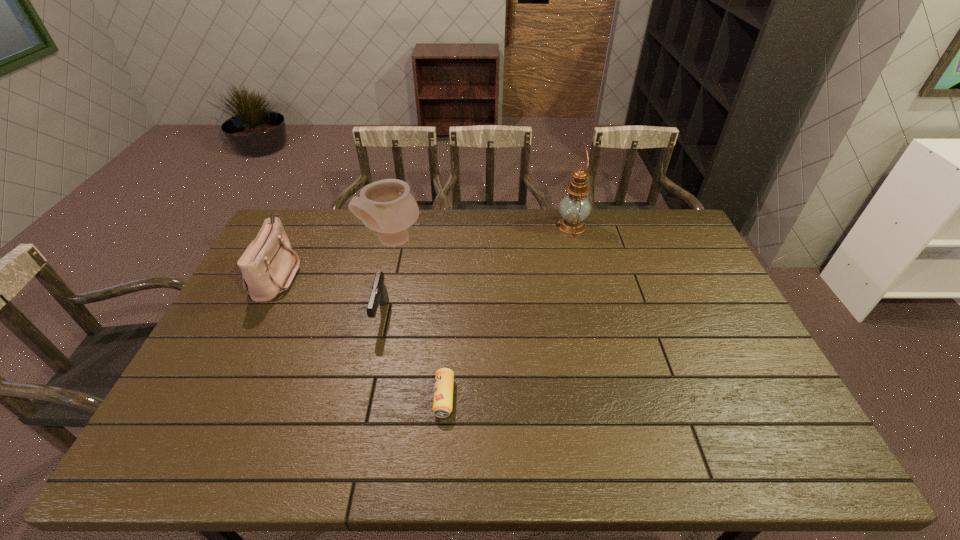
Locate an element on the screen. This screenshot has width=960, height=540. vacant space located on the front pocket of the leftmost object is located at coordinates pos(407,275).

This screenshot has height=540, width=960. I want to click on vacant space located 0.160m aim along the barrel of the second shortest object, so click(x=366, y=384).

At what (x,y) coordinates should I click in order to perform the action: click on vacant space located 0.370m on the right of the second object from right to left. Please return your answer as a coordinate pair (x, y). This screenshot has width=960, height=540. Looking at the image, I should click on coord(599,397).

Find the location of a particular element. The width and height of the screenshot is (960, 540). oil lamp at the far edge is located at coordinates (574, 208).

Where is `pottery present at the far edge`? The width and height of the screenshot is (960, 540). pottery present at the far edge is located at coordinates pyautogui.click(x=386, y=206).

The width and height of the screenshot is (960, 540). What are the coordinates of `object located in the left edge section of the desktop` in the screenshot? It's located at (268, 265).

The image size is (960, 540). I want to click on vacant space at the far edge of the desktop, so click(x=461, y=227).

In the image, there is a desktop. At what (x,y) coordinates should I click in order to perform the action: click on vacant space at the left edge. Please return your answer as a coordinate pair (x, y). Looking at the image, I should click on (191, 395).

At what (x,y) coordinates should I click in order to perform the action: click on free space at the right edge. Please return your answer as a coordinate pair (x, y). The image size is (960, 540). Looking at the image, I should click on tap(708, 378).

You are a GUI agent. You are given a task and a screenshot of the screen. Output one action in this format:
    pyautogui.click(x=<x>, y=<y>)
    Task: Click on the vacant region at the far left corner
    The height and width of the screenshot is (540, 960).
    Given the screenshot: What is the action you would take?
    pyautogui.click(x=314, y=229)